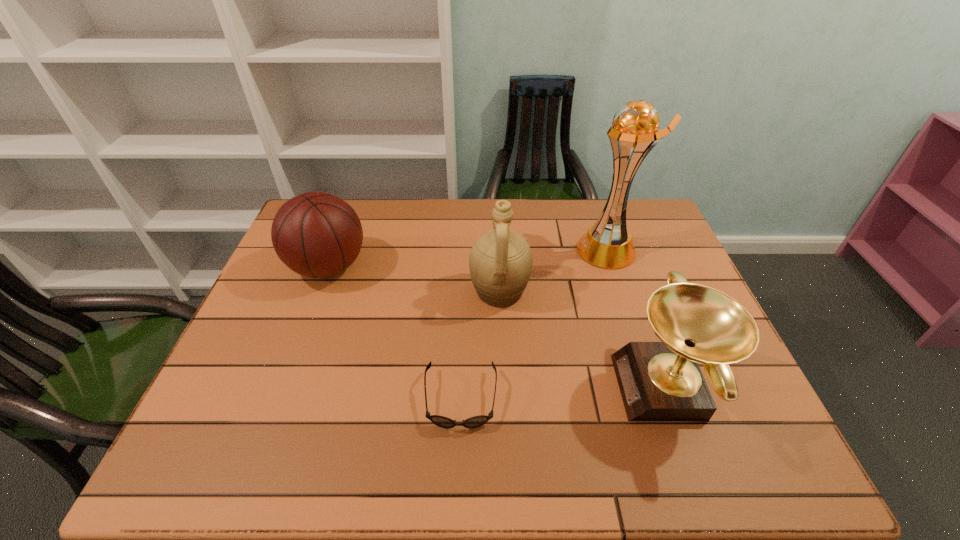
Identify the location of vacant area that lies between the award and the trophy. (636, 319).

The image size is (960, 540). Identify the location of empty space between the basketball and the tallest object. (468, 258).

This screenshot has height=540, width=960. I want to click on free spot between the leftmost object and the tallest object, so pyautogui.click(x=468, y=258).

Locate an element on the screen. The width and height of the screenshot is (960, 540). free space between the fourth shortest object and the award is located at coordinates (583, 340).

Locate an element on the screen. free space that is in between the basketball and the tallest object is located at coordinates (468, 258).

In order to click on object that is the third closest to the award in this screenshot , I will do `click(473, 422)`.

The height and width of the screenshot is (540, 960). In order to click on object that stands as the third closest to the pitcher in this screenshot , I will do `click(659, 381)`.

Identify the location of free space in the image that satisfies the following two spatial constraints: 1. on the front side of the pitcher; 2. on the left side of the leftmost object. (319, 291).

Identify the location of vacant area in the image that satisfies the following two spatial constraints: 1. on the front side of the fourth shortest object; 2. on the left side of the leftmost object. This screenshot has height=540, width=960. (319, 291).